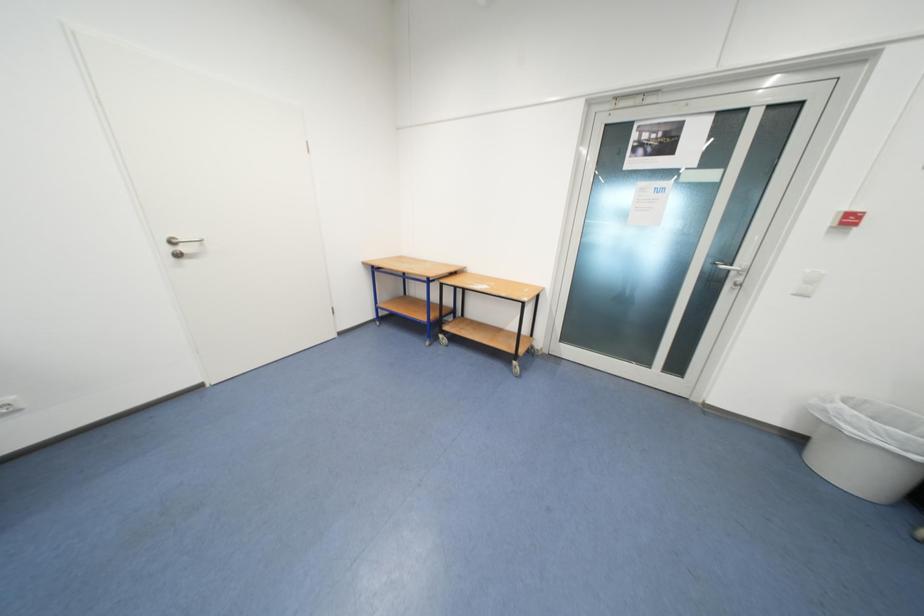
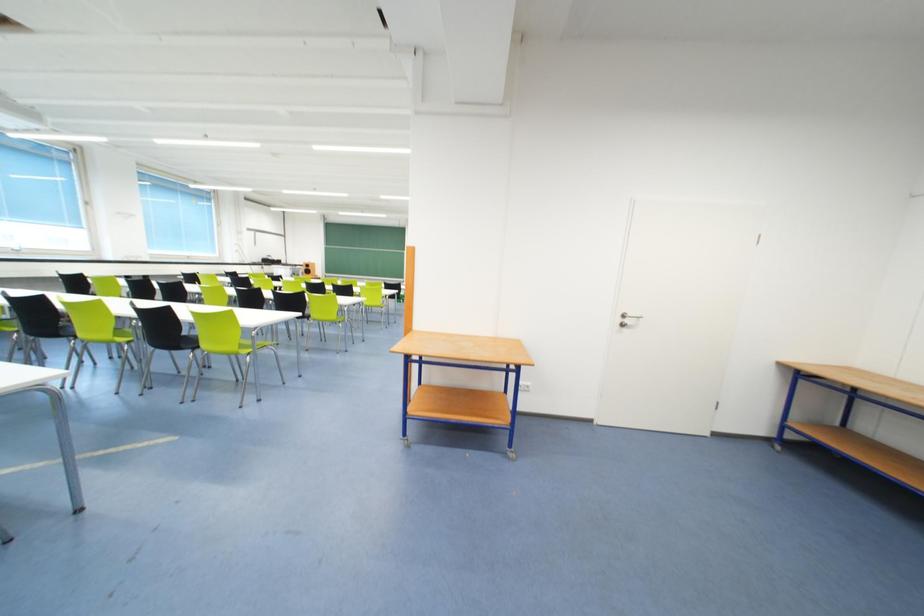
Question: The images are taken continuously from a first-person perspective. In which direction is your viewpoint rotating?

Choices:
 (A) Left
 (B) Right
 (C) Up
 (D) Down

Answer: (A)